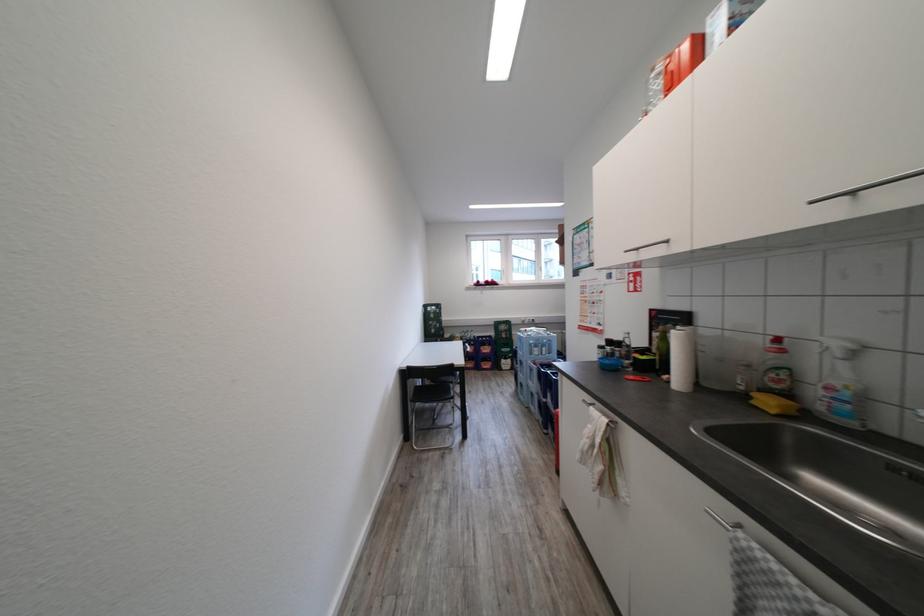
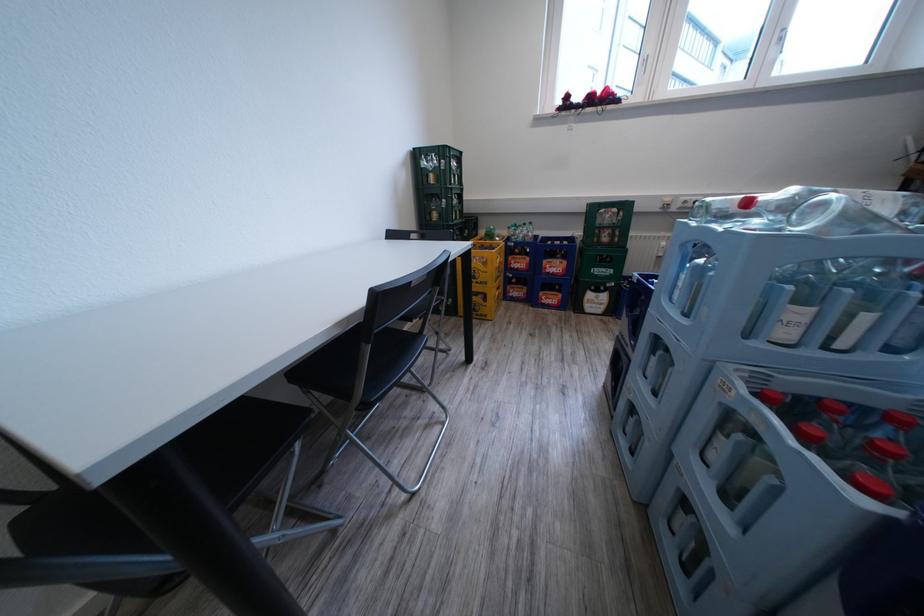
Question: In a continuous first-person perspective shot, in which direction is the camera moving?

Choices:
 (A) Left
 (B) Right
 (C) Forward
 (D) Backward

Answer: (C)